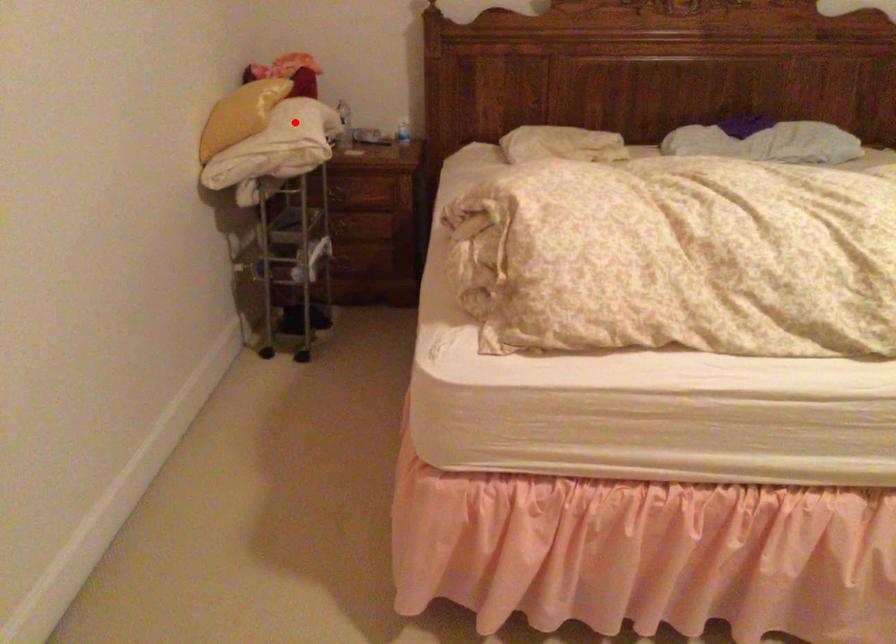
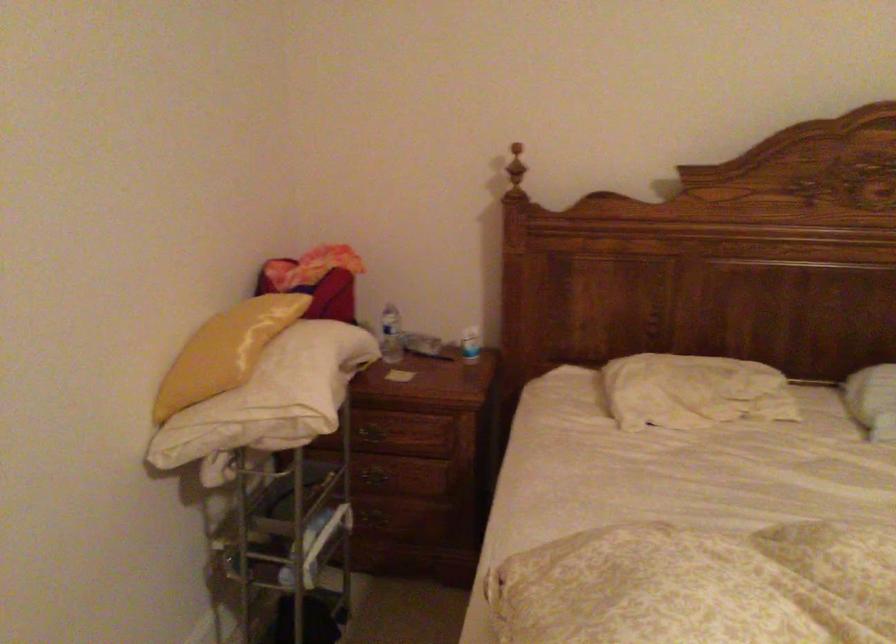
Where in the second image is the point corresponding to the highlighted location from the first image?

(287, 375)